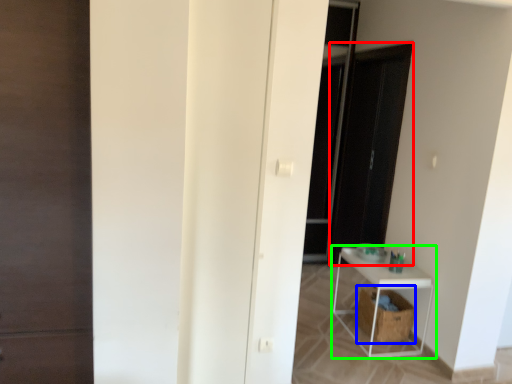
Question: Which is farther away from screen door (highlighted by a red box)? laundry basket (highlighted by a blue box) or shelf (highlighted by a green box)?

Choices:
 (A) laundry basket
 (B) shelf

Answer: (A)